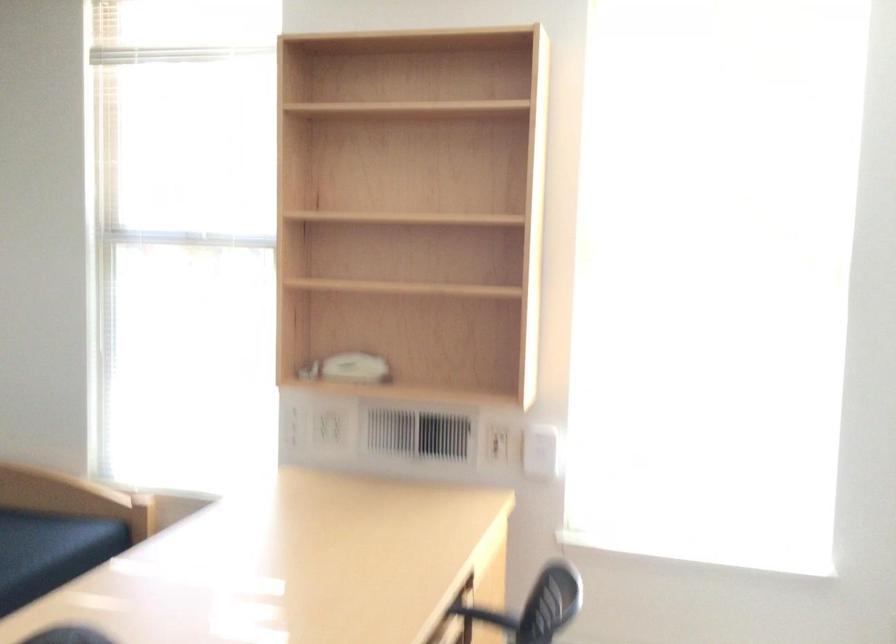
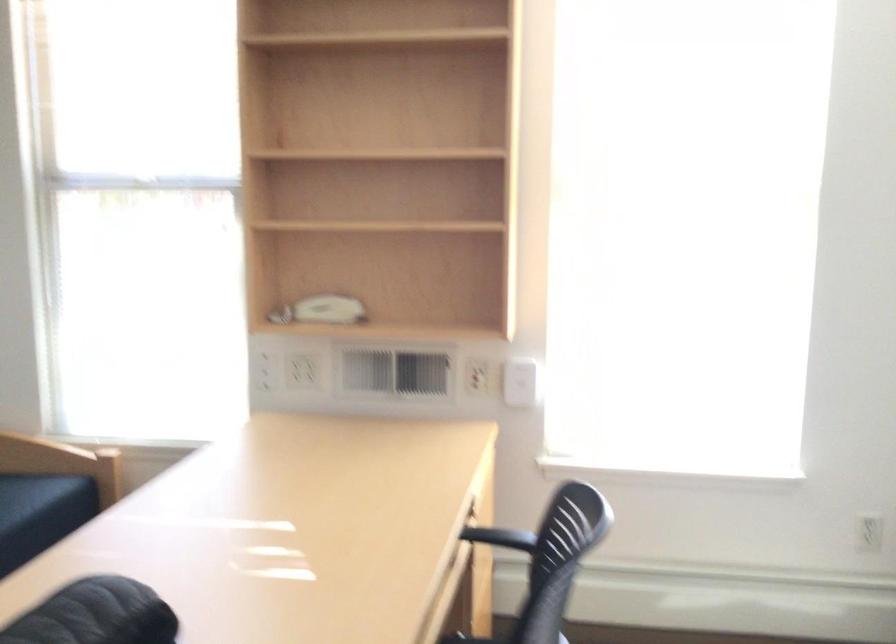
Where in the second image is the point corresponding to (x=350, y=375) from the first image?

(324, 314)